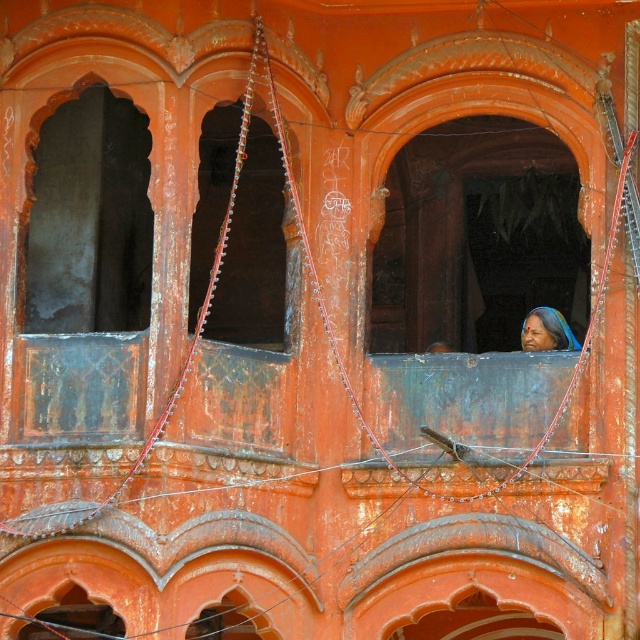
Is dark gray stone arch at left wider than matte blue sari at center?

Indeed, dark gray stone arch at left has a greater width compared to matte blue sari at center.

Who is more distant from viewer, (x=90, y=240) or (x=557, y=332)?

The point (x=90, y=240) is more distant.

What do you see at coordinates (90, 218) in the screenshot?
I see `dark gray stone arch at left` at bounding box center [90, 218].

What are the coordinates of `dark gray stone arch at left` in the screenshot? It's located at (90, 218).

Between dark gray stone arch at left and dark brown wooden window at center, which one is positioned lower?

dark brown wooden window at center

What are the coordinates of `dark gray stone arch at left` in the screenshot? It's located at (90, 218).

Who is more forward, (102, 205) or (225, 296)?

Point (102, 205) is more forward.

Identify the location of dark gray stone arch at left. The height and width of the screenshot is (640, 640). (90, 218).

Between dark brown wooden window at center and matte blue sari at center, which one has more height?

Standing taller between the two is dark brown wooden window at center.

In the scene shown: Can you confirm if dark brown wooden window at center is positioned to the left of matte blue sari at center?

Yes, dark brown wooden window at center is to the left of matte blue sari at center.

Is point (252, 157) positioned behind point (538, 323)?

Yes, it is behind point (538, 323).

Identify the location of dark brown wooden window at center. The image size is (640, 640). (253, 252).